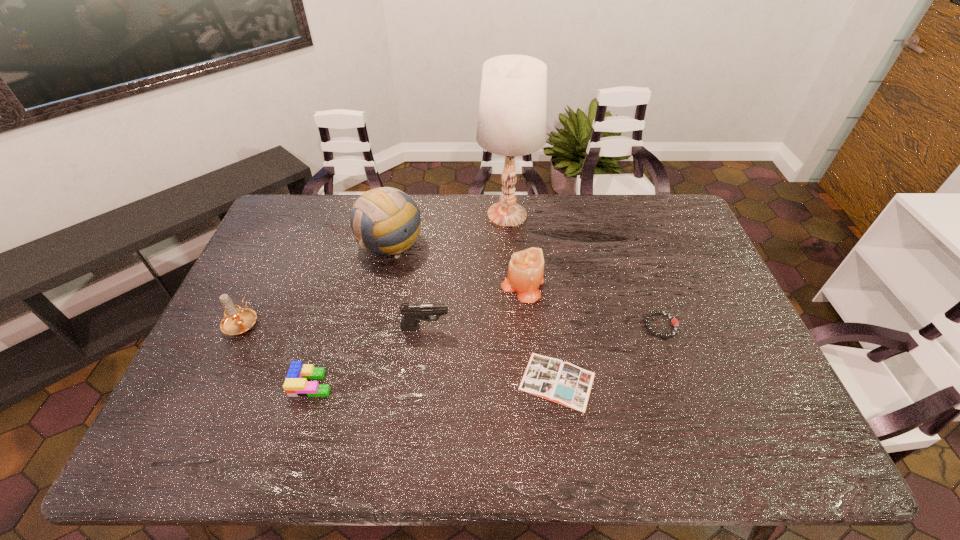
Locate an element on the screen. The width and height of the screenshot is (960, 540). empty space between the leftmost object and the shortest object is located at coordinates (399, 352).

You are a GUI agent. You are given a task and a screenshot of the screen. Output one action in this format:
    pyautogui.click(x=<x>, y=<y>)
    Task: Click on the vacant region between the shortest object and the left candle
    
    Given the screenshot: What is the action you would take?
    pyautogui.click(x=399, y=352)

At what (x,y) coordinates should I click in order to perform the action: click on unoccupied position between the rightmost object and the pistol. Please return your answer as a coordinate pair (x, y). This screenshot has height=540, width=960. Looking at the image, I should click on (543, 327).

You are a GUI agent. You are given a task and a screenshot of the screen. Output one action in this format:
    pyautogui.click(x=<x>, y=<y>)
    Task: Click on the unoccupied area between the shortest object and the second tallest object
    The width and height of the screenshot is (960, 540).
    Given the screenshot: What is the action you would take?
    pyautogui.click(x=473, y=312)

Where is `vacant space that's between the shortest object and the second shortest object`? This screenshot has height=540, width=960. vacant space that's between the shortest object and the second shortest object is located at coordinates (609, 354).

Identify the location of vacant point located between the sixth nearest object and the fourth shortest object. (474, 306).

Locate an element on the screen. This screenshot has height=540, width=960. object that is the second closest to the fourth shortest object is located at coordinates (561, 382).

Locate an element on the screen. object that ranks as the third closest to the shortest object is located at coordinates (413, 312).

The image size is (960, 540). Identify the location of vacant space that satisfies the following two spatial constraints: 1. on the front side of the tallest object; 2. on the left side of the rightmost object. click(x=515, y=326).

At what (x,y) coordinates should I click in order to perform the action: click on free location that satisfies the following two spatial constraints: 1. at the barrel of the book; 2. on the left side of the pistol. Please return your answer as a coordinate pair (x, y). This screenshot has height=540, width=960. Looking at the image, I should click on (420, 381).